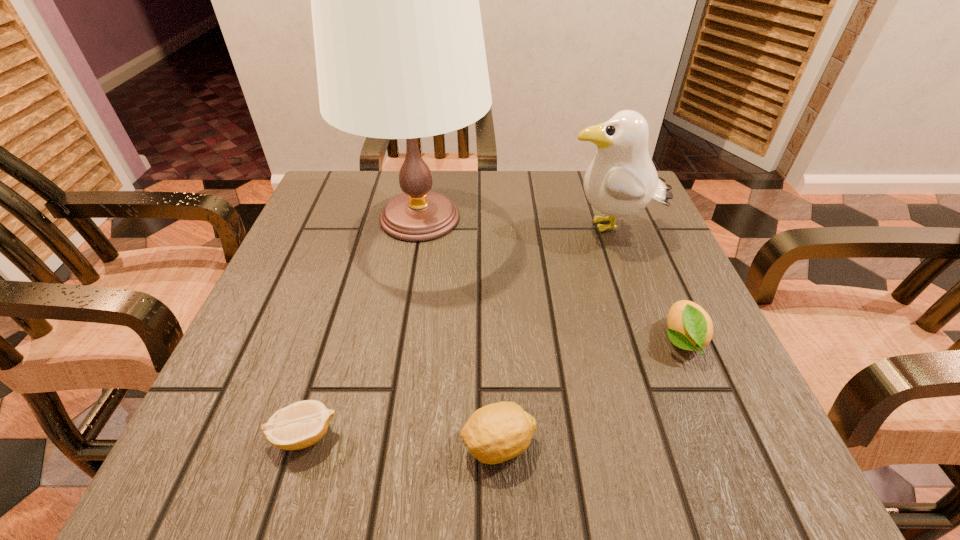
The height and width of the screenshot is (540, 960). I want to click on free space that is in between the second lemon from left to right and the leftmost lemon, so click(x=401, y=440).

Select which object is the fourth closest to the gull. Please provide its 2D coordinates. Your answer should be formatted as a tuple, i.e. [(x, y)], where the tuple contains the x and y coordinates of a point satisfying the conditions above.

[(301, 424)]

Image resolution: width=960 pixels, height=540 pixels. Find the location of `object that stands as the fourth closest to the shortest object`. object that stands as the fourth closest to the shortest object is located at coordinates (621, 180).

Select which lemon appears as the second closest to the fourth shortest object. Please provide its 2D coordinates. Your answer should be formatted as a tuple, i.e. [(x, y)], where the tuple contains the x and y coordinates of a point satisfying the conditions above.

[(495, 433)]

Where is `lemon that stands as the second closest to the second lemon from left to right`? The image size is (960, 540). lemon that stands as the second closest to the second lemon from left to right is located at coordinates (690, 327).

Where is `free space that satisfies the following two spatial constraints: 1. with leaves positioned above the third nearest object; 2. at the stem end of the second lemon from right to left`? Image resolution: width=960 pixels, height=540 pixels. free space that satisfies the following two spatial constraints: 1. with leaves positioned above the third nearest object; 2. at the stem end of the second lemon from right to left is located at coordinates (725, 444).

You are a GUI agent. You are given a task and a screenshot of the screen. Output one action in this format:
    pyautogui.click(x=<x>, y=<y>)
    Task: Click on the free space that satisfies the following two spatial constraints: 1. with leaves positioned above the third nearest object; 2. at the stem end of the second lemon from left to right
    This screenshot has height=540, width=960.
    Given the screenshot: What is the action you would take?
    pyautogui.click(x=725, y=444)

This screenshot has height=540, width=960. I want to click on vacant space that satisfies the following two spatial constraints: 1. with leaves positioned above the farthest lemon; 2. at the stem end of the second lemon from right to left, so click(725, 444).